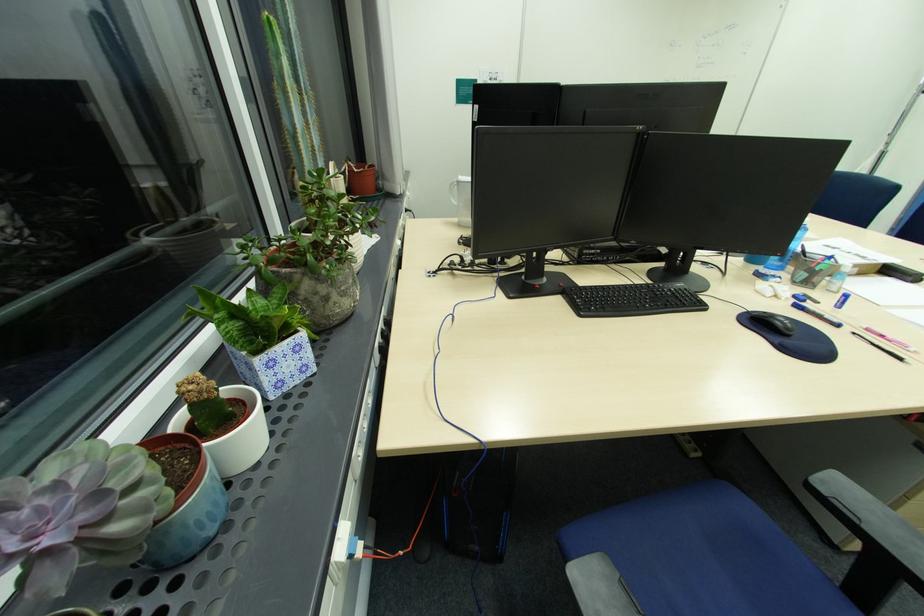
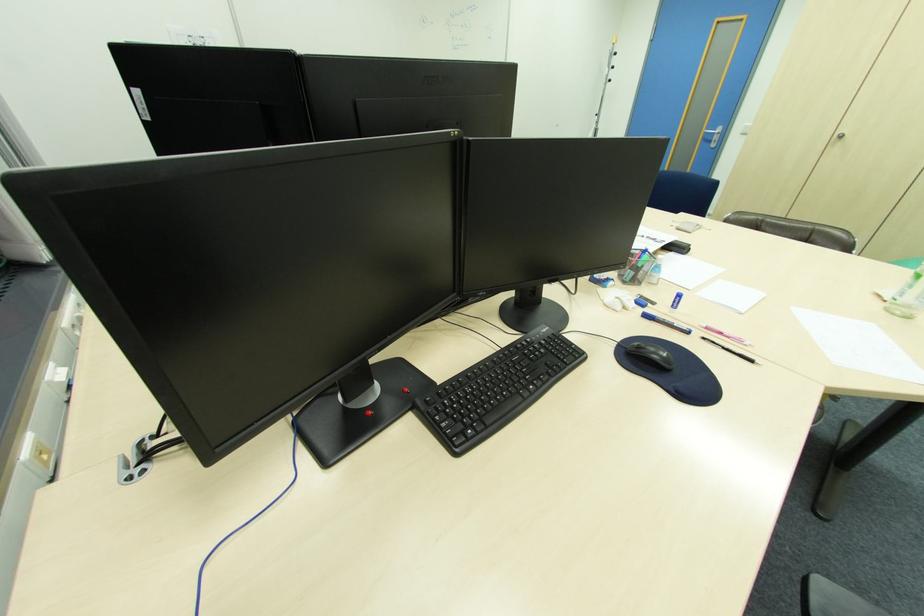
Where in the second image is the point corresponding to point (666, 286) from the first image?

(533, 339)